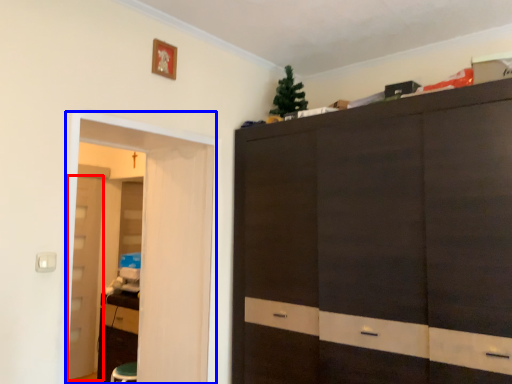
Question: Which point is closer to the camera, door (highlighted by a red box) or screen door (highlighted by a blue box)?

Choices:
 (A) door
 (B) screen door

Answer: (B)